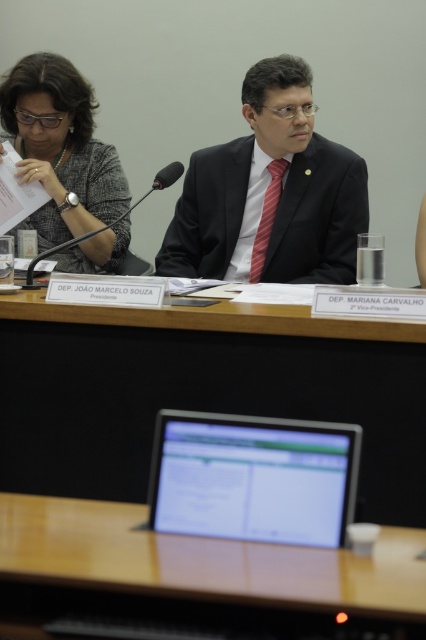
Who is more forward, (371, 518) or (221, 166)?

Point (371, 518)

Measure the distance between smooth wooden table at center and matte black suit at center.

A distance of 30.54 inches exists between smooth wooden table at center and matte black suit at center.

Between point (402, 342) and point (345, 252), which one is positioned behind?

The point (345, 252) is more distant.

You are a GUI agent. You are given a task and a screenshot of the screen. Output one action in this format:
    pyautogui.click(x=<x>, y=<y>)
    Task: Click on the smooth wooden table at center
    This screenshot has width=426, height=640.
    Given the screenshot: What is the action you would take?
    pyautogui.click(x=198, y=396)

Between wooden table at center and matte black suit at center, which one is positioned lower?

wooden table at center is lower down.

Does wooden table at center have a larger size compared to matte black suit at center?

No, wooden table at center is not bigger than matte black suit at center.

Is point (330, 586) positioned in front of point (331, 260)?

Yes, point (330, 586) is in front of point (331, 260).

Where is `wooden table at center`? Image resolution: width=426 pixels, height=640 pixels. wooden table at center is located at coordinates (193, 570).

Which is more to the left, matte black suit at center or silver glossy monitor at center?

From the viewer's perspective, silver glossy monitor at center appears more on the left side.

Is matte black suit at center wider than silver glossy monitor at center?

Indeed, matte black suit at center has a greater width compared to silver glossy monitor at center.

Between point (298, 253) and point (322, 490), which one is positioned in front?

Point (322, 490) is more forward.

Where is `matte black suit at center`? This screenshot has width=426, height=640. matte black suit at center is located at coordinates [270, 193].